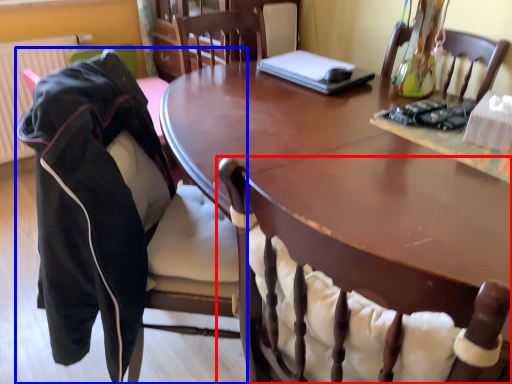
Question: Which object appears closest to the camera in this image, chair (highlighted by a red box) or chair (highlighted by a blue box)?

Choices:
 (A) chair
 (B) chair

Answer: (A)